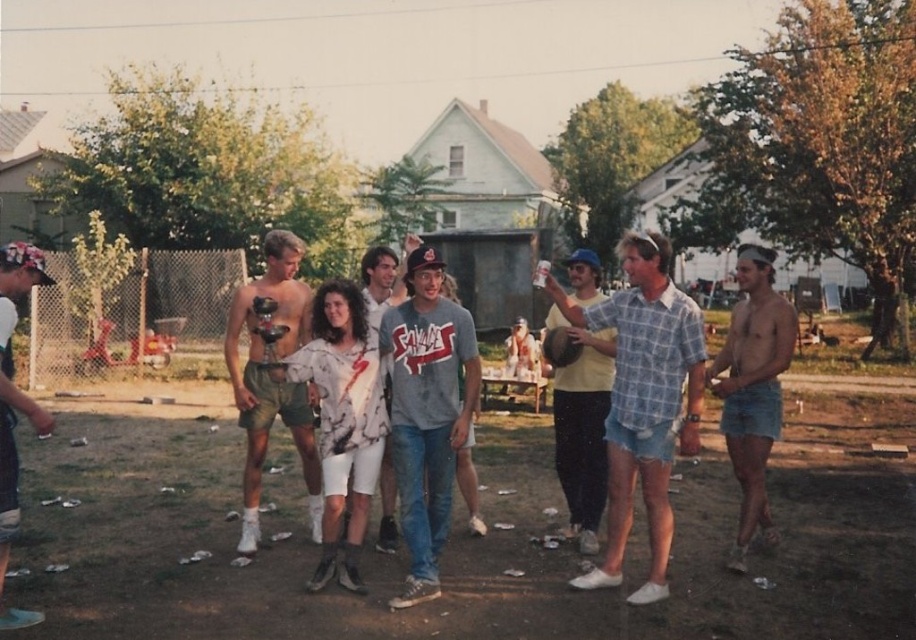
Is point (566, 420) positioned in front of point (37, 419)?

No, (566, 420) is behind (37, 419).

Between yellow matte shirt at center and white cotton cap at left, which one has more height?

With more height is white cotton cap at left.

This screenshot has height=640, width=916. Identify the location of yellow matte shirt at center. (581, 426).

Does plaid cotton shirt at center have a greater width compared to shiny metallic trophy at center?

Yes, plaid cotton shirt at center is wider than shiny metallic trophy at center.

Is plaid cotton shirt at center thinner than shiny metallic trophy at center?

Incorrect, plaid cotton shirt at center's width is not less than shiny metallic trophy at center's.

Which is behind, point (640, 300) or point (255, 500)?

The point (255, 500) is more distant.

This screenshot has height=640, width=916. I want to click on plaid cotton shirt at center, so click(x=642, y=401).

Between white cotton shorts at center and denim shorts at right, which one appears on the right side from the viewer's perspective?

Positioned to the right is denim shorts at right.

Does point (354, 387) come farther from viewer compared to point (762, 349)?

No, (354, 387) is closer to viewer.

Find the location of a particular element. This screenshot has width=916, height=640. white cotton shorts at center is located at coordinates (344, 420).